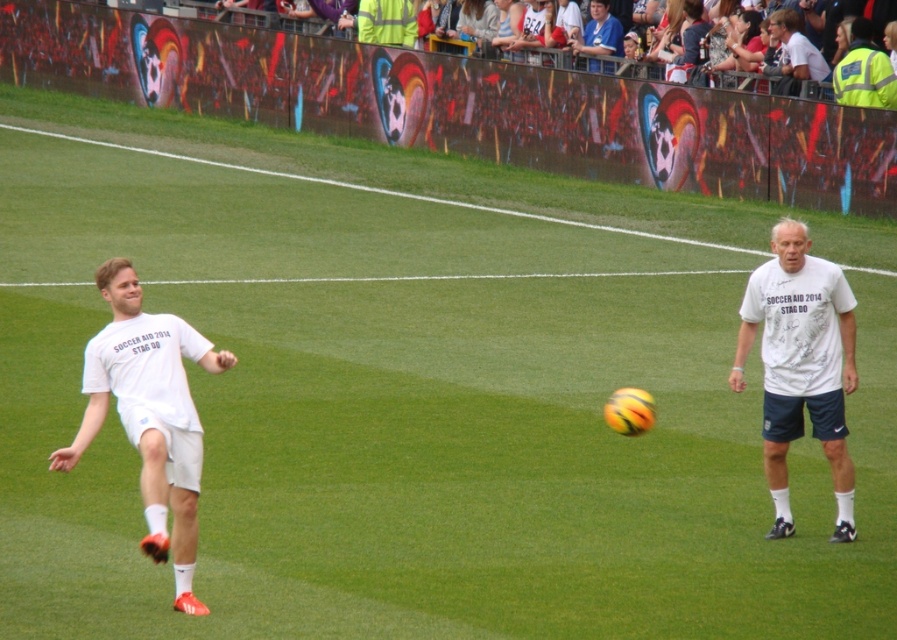
Is white cotton t-shirt at center positioned behind white cotton shirt at upper center?

No, white cotton t-shirt at center is in front of white cotton shirt at upper center.

Can you confirm if white cotton t-shirt at center is positioned to the right of white cotton shirt at upper center?

No, white cotton t-shirt at center is not to the right of white cotton shirt at upper center.

Is point (782, 416) farther from camera compared to point (786, 38)?

That is False.

Locate an element on the screen. The width and height of the screenshot is (897, 640). white cotton t-shirt at center is located at coordinates (800, 364).

Who is shorter, white matte t-shirt at left or white cotton t-shirt at center?

Standing shorter between the two is white matte t-shirt at left.

Does white matte t-shirt at left have a lesser width compared to white cotton t-shirt at center?

No.

Is point (194, 461) closer to viewer compared to point (774, 380)?

Yes, point (194, 461) is closer to viewer.

At what (x,y) coordinates should I click in order to perform the action: click on white matte t-shirt at left. Please return your answer as a coordinate pair (x, y). The image size is (897, 640). Looking at the image, I should click on click(x=149, y=413).

Who is taller, white matte t-shirt at left or white cotton shirt at upper center?

With more height is white matte t-shirt at left.

Consider the image. Is white matte t-shirt at left to the right of white cotton shirt at upper center from the viewer's perspective?

In fact, white matte t-shirt at left is to the left of white cotton shirt at upper center.

Which is in front, point (138, 480) or point (795, 64)?

Positioned in front is point (138, 480).

Find the location of a particular element. white matte t-shirt at left is located at coordinates (149, 413).